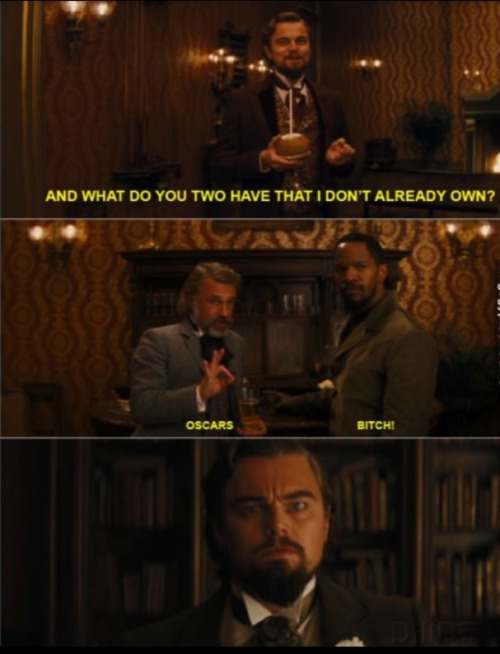
Locate an element on the screen. bookshelf is located at coordinates (138, 492), (367, 479), (471, 506).